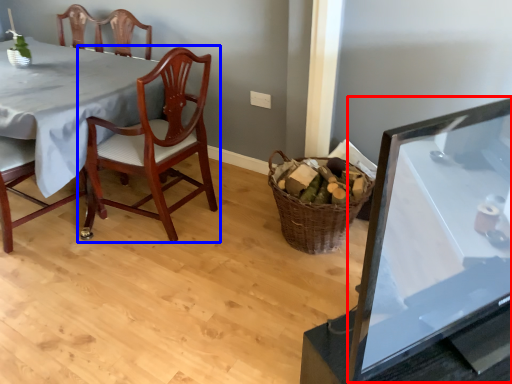
Question: Which object is further to the camera taking this photo, table (highlighted by a red box) or chair (highlighted by a blue box)?

Choices:
 (A) table
 (B) chair

Answer: (B)